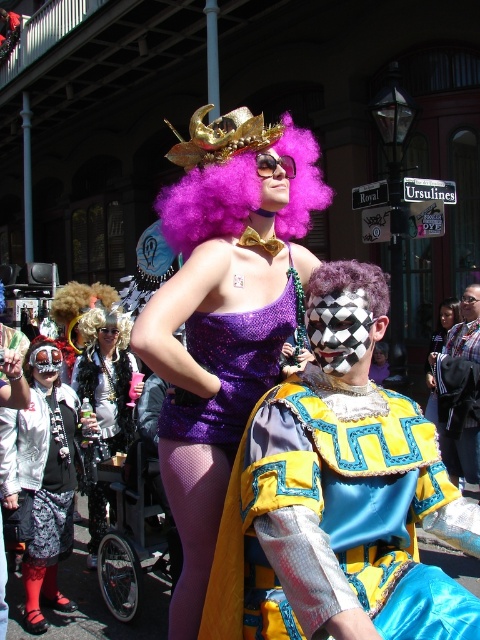
You are a photographer trying to capture the festive atmosphere. You notice the shiny yellow fabric at center and the matte black mask at center. Which object should you focus on if you want to highlight the element that is more to the right?

The shiny yellow fabric at center is positioned on the right side of matte black mask at center, so you should focus on the shiny yellow fabric at center to highlight the element more to the right.

You are a photographer positioned at the back of the crowd. You want to take a photo of both the shiny blonde wig at center and the matte black wig at upper center without any obstructions. Given that your camera has a maximum focus range of 5 meters, will you be able to capture both subjects clearly in the same frame?

The distance between the shiny blonde wig at center and the matte black wig at upper center is 4.69 meters, which is within the camera maximum focus range of 5 meters. Therefore, you can capture both subjects clearly in the same frame.

Consider the image. You are a photographer trying to capture both the purple sequined dress at center and the blue denim jacket at center in a single frame. Based on their positions, which one should you focus on first to ensure both are in the shot?

The purple sequined dress at center is to the left of the blue denim jacket at center, so you should focus on the blue denim jacket at center first to ensure both are in the shot.